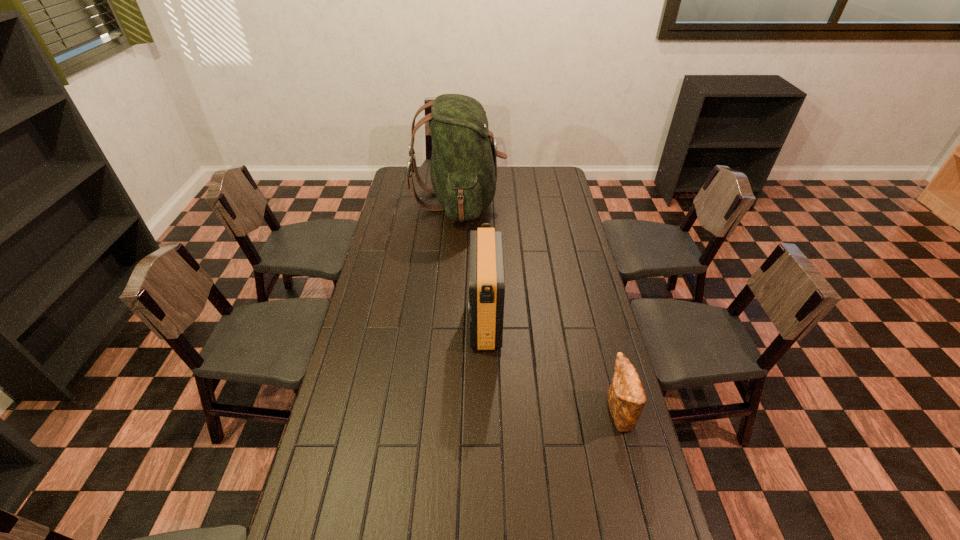
The image size is (960, 540). What are the coordinates of `vacant space that's between the rightmost object and the second tallest object` in the screenshot? It's located at (551, 367).

Locate an element on the screen. This screenshot has height=540, width=960. vacant area between the radio receiver and the rightmost object is located at coordinates (551, 367).

Locate an element on the screen. free space between the backpack and the shortest object is located at coordinates (539, 308).

Identify the location of object that can be found as the second closest to the second nearest object. Image resolution: width=960 pixels, height=540 pixels. (463, 170).

Find the location of a particular element. The height and width of the screenshot is (540, 960). object that is the closest to the shortest object is located at coordinates (486, 288).